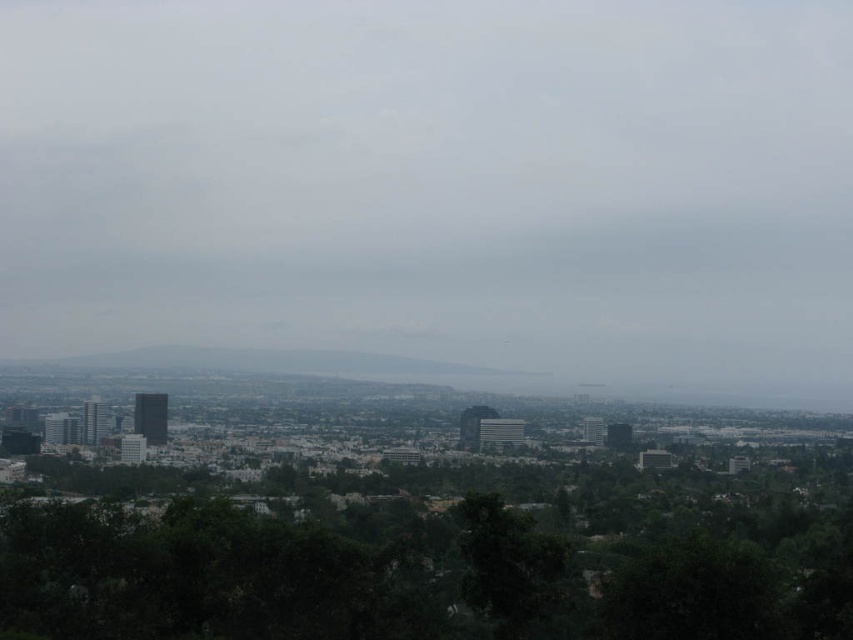
Question: Where is gray matte cloud at center located in relation to green leafy tree at lower center in the image?

Choices:
 (A) right
 (B) left

Answer: (B)

Question: Which of the following is the farthest from the observer?

Choices:
 (A) (675, 154)
 (B) (392, 576)

Answer: (A)

Question: Is gray matte cloud at center smaller than green leafy tree at lower center?

Choices:
 (A) yes
 (B) no

Answer: (A)

Question: Does gray matte cloud at center lie in front of green leafy tree at lower center?

Choices:
 (A) yes
 (B) no

Answer: (B)